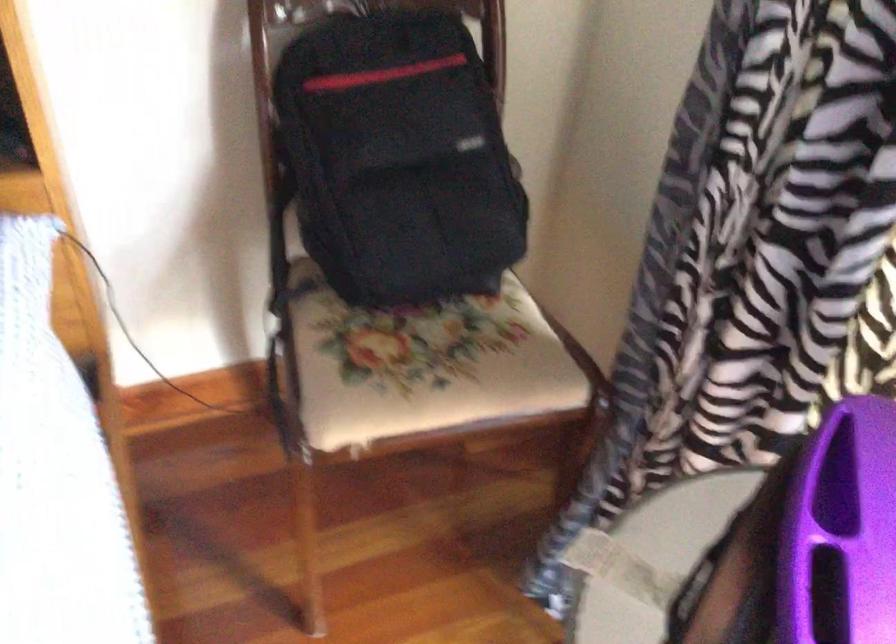
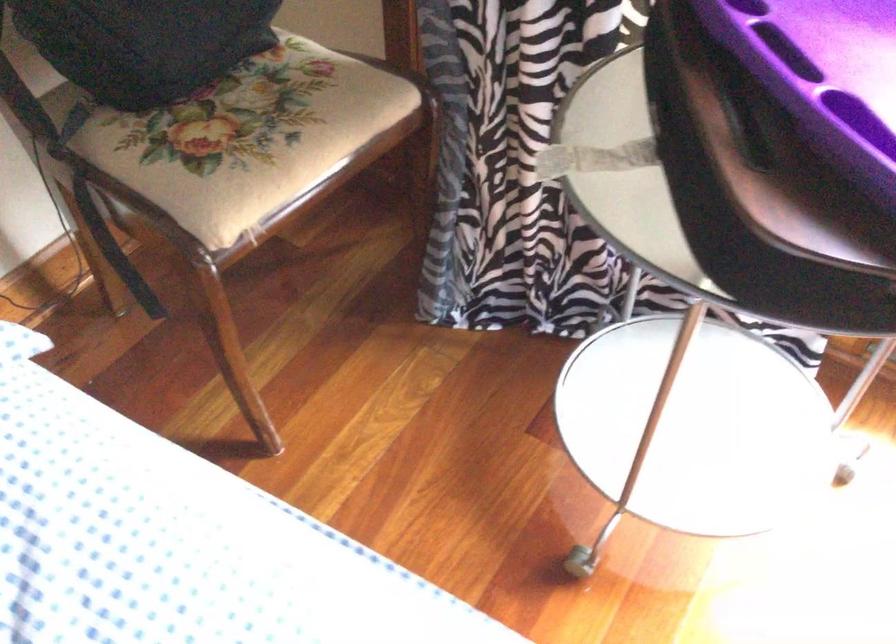
In the second image, find the point that corresponds to [408,377] in the first image.

(259, 145)